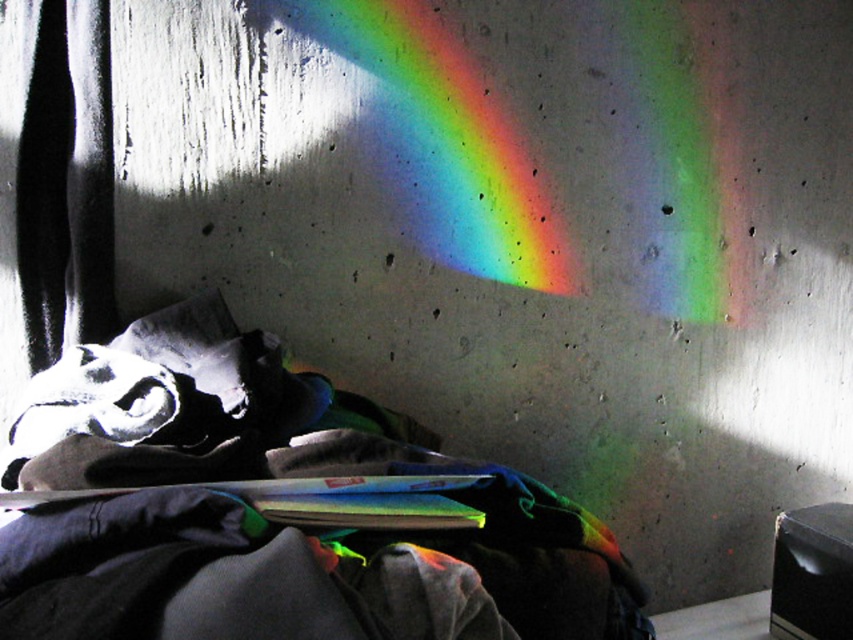
Question: Which of the following is the farthest from the observer?

Choices:
 (A) dark gray fabric at center
 (B) rainbow spectrum at upper center

Answer: (B)

Question: Which object is farther from the camera taking this photo?

Choices:
 (A) dark gray fabric at center
 (B) rainbow spectrum at upper center

Answer: (B)

Question: Does dark gray fabric at center appear over rainbow spectrum at upper center?

Choices:
 (A) yes
 (B) no

Answer: (B)

Question: Can you confirm if dark gray fabric at center is positioned below rainbow spectrum at upper center?

Choices:
 (A) no
 (B) yes

Answer: (B)

Question: Where is dark gray fabric at center located in relation to rainbow spectrum at upper center in the image?

Choices:
 (A) below
 (B) above

Answer: (A)

Question: Which object appears closest to the camera in this image?

Choices:
 (A) dark gray fabric at center
 (B) rainbow spectrum at upper center

Answer: (A)